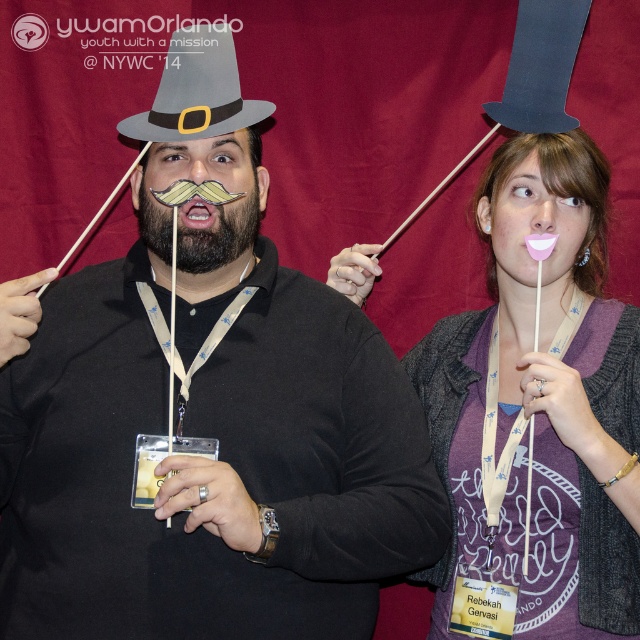
You are a photographer at the event and want to focus on the purple matte shirt at center and the brownwoodybeard at center. Which one is closer to your camera lens?

The purple matte shirt at center is closer to the viewer than brownwoodybeard at center, so the purple matte shirt at center would be closer to the camera lens.

You are a photographer at the event and need to ensure that both the purple matte shirt at center and the gray felt hat at upper center are visible in the photo. Given their sizes, which object will require more horizontal space in the frame?

The purple matte shirt at center requires more horizontal space in the frame because its width surpasses that of the gray felt hat at upper center.

Consider the image. You are a photographer at the event. You need to adjust the lighting so that the purple matte shirt at center and the gray felt hat at upper center are both visible. Which object should you focus on first to ensure proper exposure?

The purple matte shirt at center is in front of the gray felt hat at upper center, so you should focus on the purple matte shirt at center first to ensure it is properly exposed before adjusting for the hat behind it.